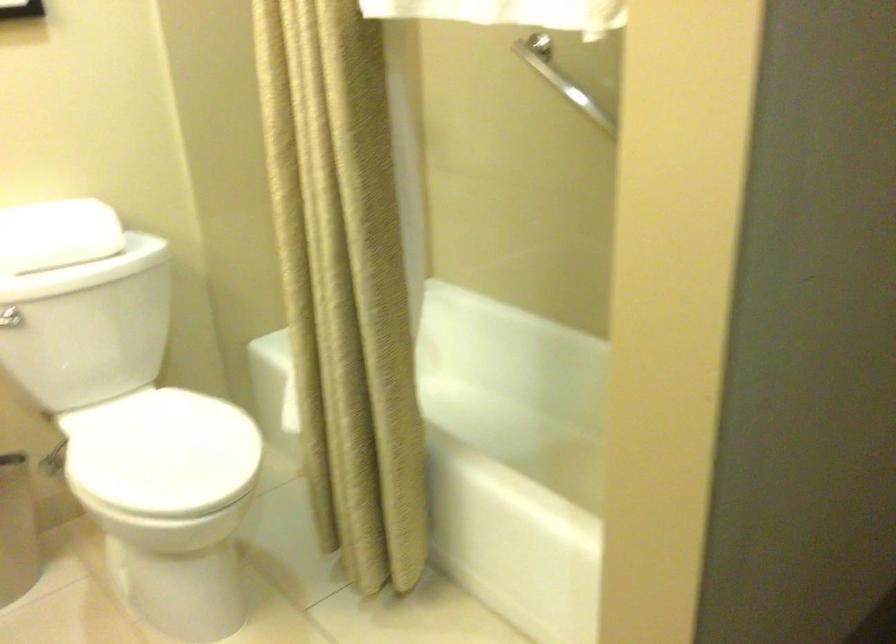
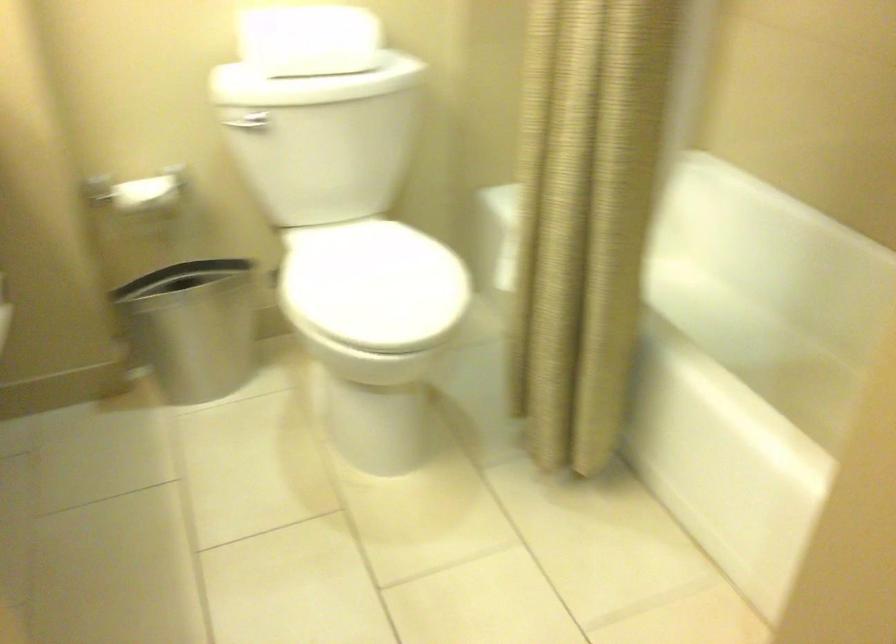
Question: Which direction would the cameraman need to move to produce the second image? Reply with the corresponding letter.

Choices:
 (A) Left
 (B) Right
 (C) Forward
 (D) Backward

Answer: (C)